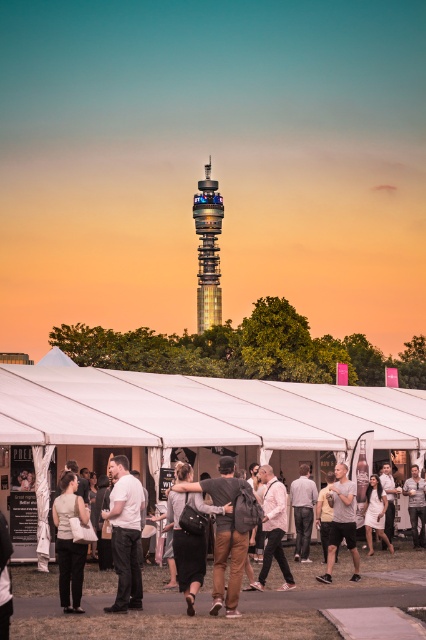
Who is more distant from viewer, (379, 509) or (420, 490)?

Point (420, 490)

Where is `white satin dress at center`? The width and height of the screenshot is (426, 640). white satin dress at center is located at coordinates (376, 513).

Who is positioned more to the left, pink matte shirt at center or white cotton shirt at center?

From the viewer's perspective, pink matte shirt at center appears more on the left side.

Measure the distance between point [285,525] and camera.

The distance of point [285,525] from camera is 714.46 feet.

Between point (279, 499) and point (411, 508), which one is positioned in front?

Point (279, 499) is in front.

At what (x,y) coordinates should I click in order to perform the action: click on pink matte shirt at center. Please return your answer as a coordinate pair (x, y). The image size is (426, 640). Looking at the image, I should click on (273, 528).

Which is behind, point (238, 572) or point (206, 240)?

Point (206, 240)

Where is `dark gray cotton shirt at center`? The width and height of the screenshot is (426, 640). dark gray cotton shirt at center is located at coordinates (226, 564).